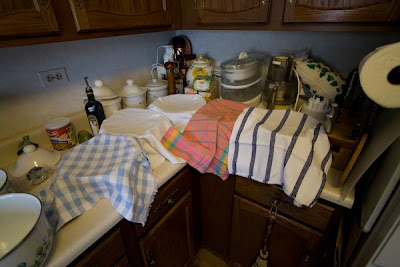
Locate an element on the screen. Image resolution: width=400 pixels, height=267 pixels. cannister bottoms is located at coordinates (110, 105), (133, 102), (155, 94), (191, 74).